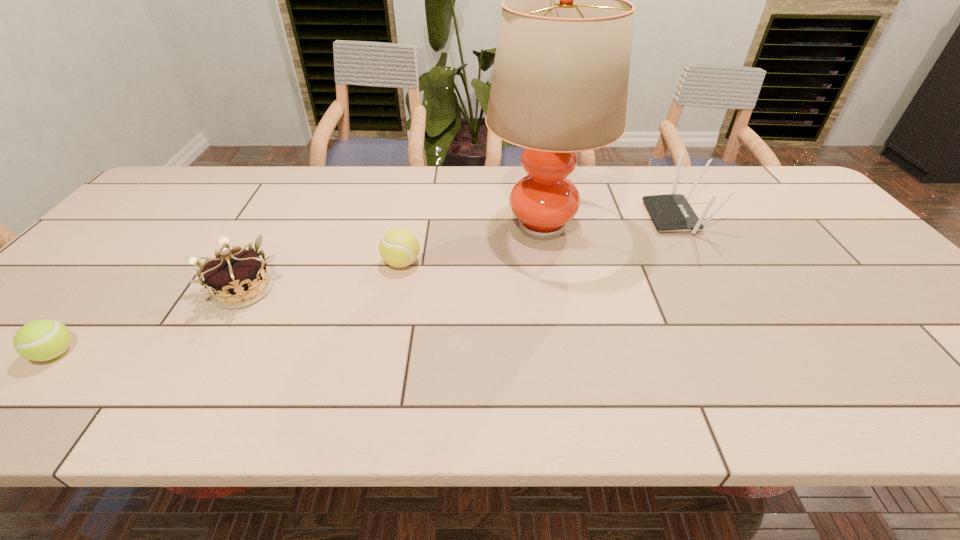
Where is `the tallest object`? This screenshot has width=960, height=540. the tallest object is located at coordinates (559, 86).

At what (x,y) coordinates should I click in order to perform the action: click on the fourth object from left to right. Please return your answer as a coordinate pair (x, y). This screenshot has height=540, width=960. Looking at the image, I should click on (559, 86).

Find the location of a particular element. The height and width of the screenshot is (540, 960). router is located at coordinates (671, 212).

This screenshot has width=960, height=540. I want to click on the third shortest object, so click(236, 278).

Where is `crown`? crown is located at coordinates (236, 278).

Identify the location of the right tennis ball. (399, 247).

Find the location of `the third object from left to right`. the third object from left to right is located at coordinates (399, 247).

This screenshot has height=540, width=960. I want to click on the shorter tennis ball, so click(x=40, y=340).

I want to click on the nearest object, so click(x=40, y=340).

Identify the location of vacant space located on the front of the lamp. This screenshot has width=960, height=540. (555, 294).